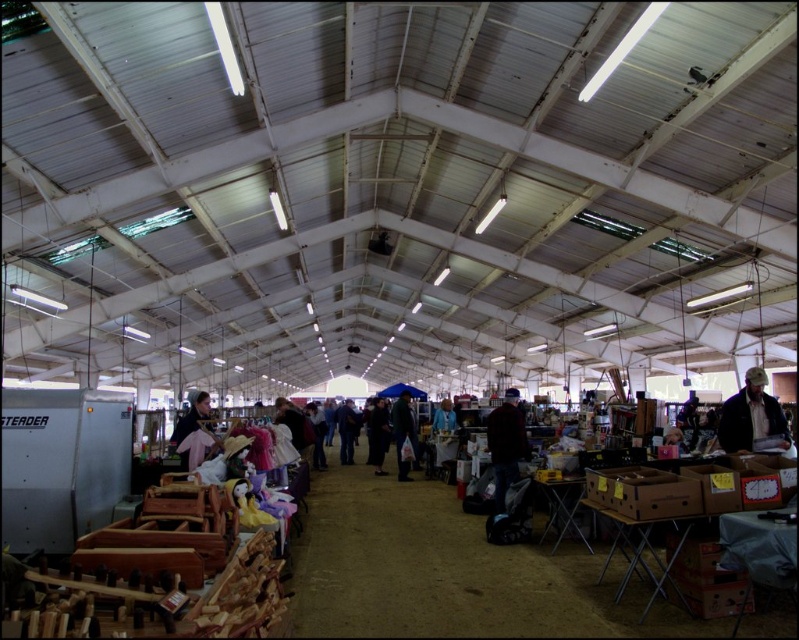
Question: Is dark red sweater at center thinner than dark blue jeans at center?

Choices:
 (A) yes
 (B) no

Answer: (B)

Question: Which point is closer to the camera taking this photo?

Choices:
 (A) (350, 440)
 (B) (191, 470)

Answer: (B)

Question: Which of the following is the closest to the observer?

Choices:
 (A) (384, 472)
 (B) (400, 472)
 (C) (507, 394)

Answer: (B)

Question: Can you confirm if dark red sweater at center is bigger than dark gray fabric jacket at center?

Choices:
 (A) no
 (B) yes

Answer: (B)

Question: Which object is positioned farthest from the brown leather jacket at lower right?

Choices:
 (A) dark gray fabric coat at center
 (B) dark gray fabric jacket at center
 (C) dark red sweater at center

Answer: (A)

Question: Does matte pink dress at left have a greater width compared to dark blue jeans at center?

Choices:
 (A) yes
 (B) no

Answer: (B)